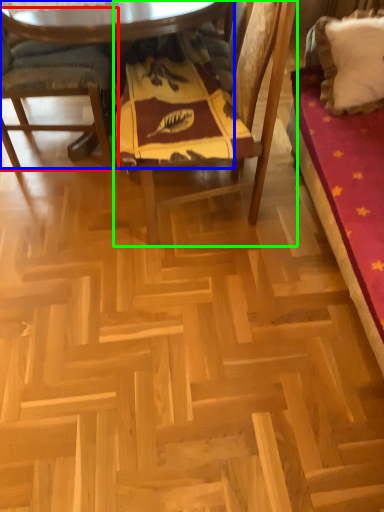
Question: Which is farther away from chair (highlighted by a red box)? table (highlighted by a blue box) or chair (highlighted by a green box)?

Choices:
 (A) table
 (B) chair

Answer: (B)